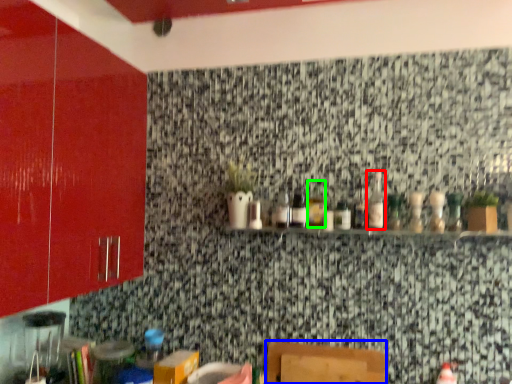
Question: Considering the real-world distances, which object is closest to bottle (highlighted by a red box)? furniture (highlighted by a blue box) or bottle (highlighted by a green box).

Choices:
 (A) furniture
 (B) bottle

Answer: (B)